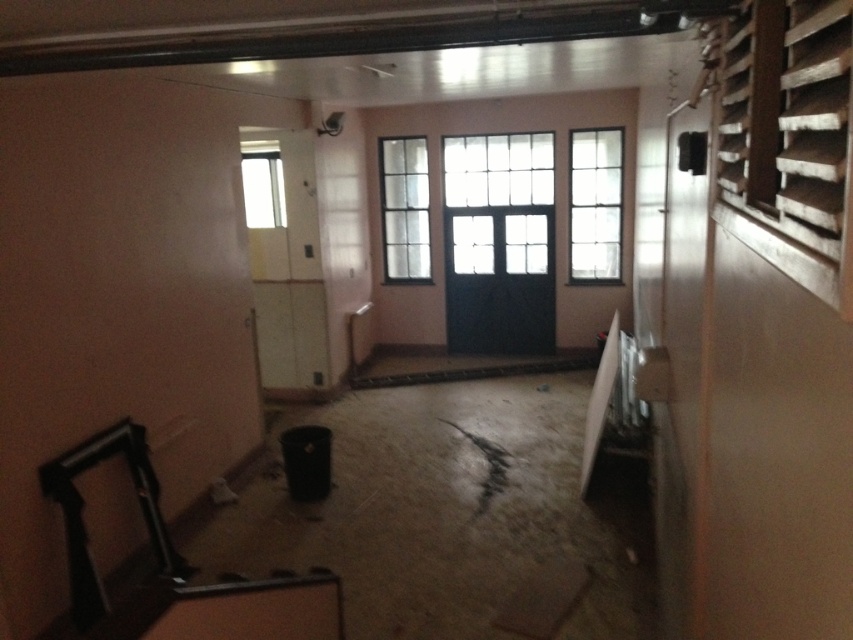
Question: Can you confirm if clear glass window at center is positioned to the right of clear glass window at upper center?

Choices:
 (A) no
 (B) yes

Answer: (B)

Question: Which point is farther to the camera?

Choices:
 (A) (526, 237)
 (B) (306, 273)
 (C) (408, 144)
 (D) (590, 257)

Answer: (C)

Question: Which is farther from the clear glass window at center?

Choices:
 (A) clear glass window at upper center
 (B) black matte door at center
 (C) white glossy door at center

Answer: (C)

Question: Which point is closer to the camera?

Choices:
 (A) (572, 195)
 (B) (282, 332)
 (C) (523, 224)
 (D) (381, 177)

Answer: (B)

Question: In this image, where is white glossy door at center located relative to clear glass window at upper center?

Choices:
 (A) right
 (B) left

Answer: (B)

Question: Can you confirm if white glossy door at center is positioned to the right of black matte door at center?

Choices:
 (A) yes
 (B) no

Answer: (B)